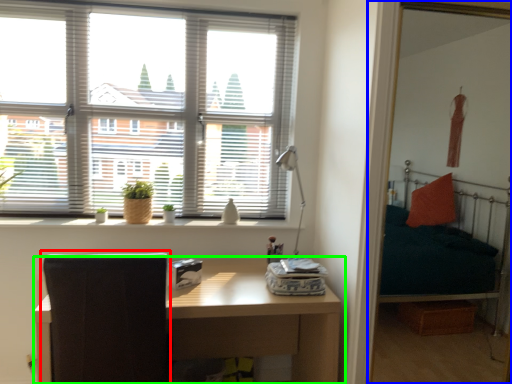
Question: Estimate the real-world distances between objects in this image. Which object is farther from swivel chair (highlighted by a red box), bunk bed (highlighted by a blue box) or table (highlighted by a green box)?

Choices:
 (A) bunk bed
 (B) table

Answer: (A)